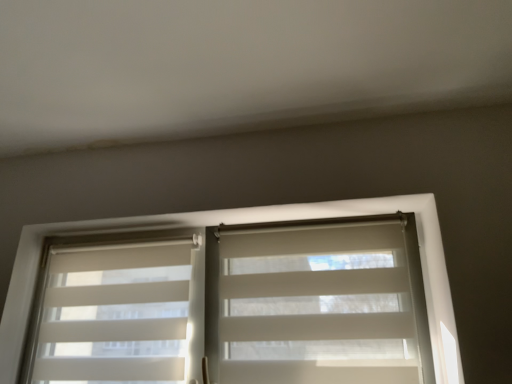
Question: From a real-world perspective, is white fabric blind at center physically above white translucent blinds at center?

Choices:
 (A) no
 (B) yes

Answer: (A)

Question: Does white fabric blind at center have a lesser width compared to white translucent blinds at center?

Choices:
 (A) yes
 (B) no

Answer: (A)

Question: Is white translucent blinds at center surrounded by white fabric blind at center?

Choices:
 (A) no
 (B) yes

Answer: (A)

Question: Does white fabric blind at center touch white translucent blinds at center?

Choices:
 (A) yes
 (B) no

Answer: (B)

Question: Is the position of white fabric blind at center more distant than that of white translucent blinds at center?

Choices:
 (A) yes
 (B) no

Answer: (B)

Question: Would you say white fabric blind at center is a long distance from white translucent blinds at center?

Choices:
 (A) no
 (B) yes

Answer: (A)

Question: Can you confirm if white textured blinds at left is wider than white translucent blinds at center?

Choices:
 (A) no
 (B) yes

Answer: (A)

Question: From the image's perspective, is white textured blinds at left on top of white translucent blinds at center?

Choices:
 (A) yes
 (B) no

Answer: (B)

Question: Is white textured blinds at left next to white translucent blinds at center and touching it?

Choices:
 (A) no
 (B) yes

Answer: (A)

Question: Is white textured blinds at left closer to camera compared to white translucent blinds at center?

Choices:
 (A) no
 (B) yes

Answer: (A)

Question: Is white textured blinds at left not within white translucent blinds at center?

Choices:
 (A) no
 (B) yes

Answer: (A)

Question: Considering the relative sizes of white textured blinds at left and white translucent blinds at center in the image provided, is white textured blinds at left taller than white translucent blinds at center?

Choices:
 (A) yes
 (B) no

Answer: (B)

Question: Could white textured blinds at left be considered to be inside white translucent blinds at center?

Choices:
 (A) no
 (B) yes

Answer: (B)